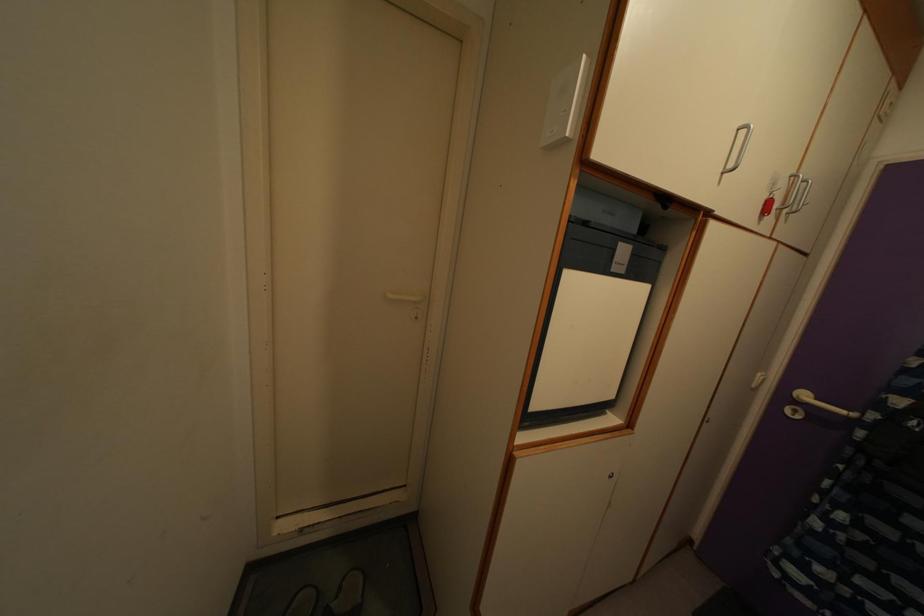
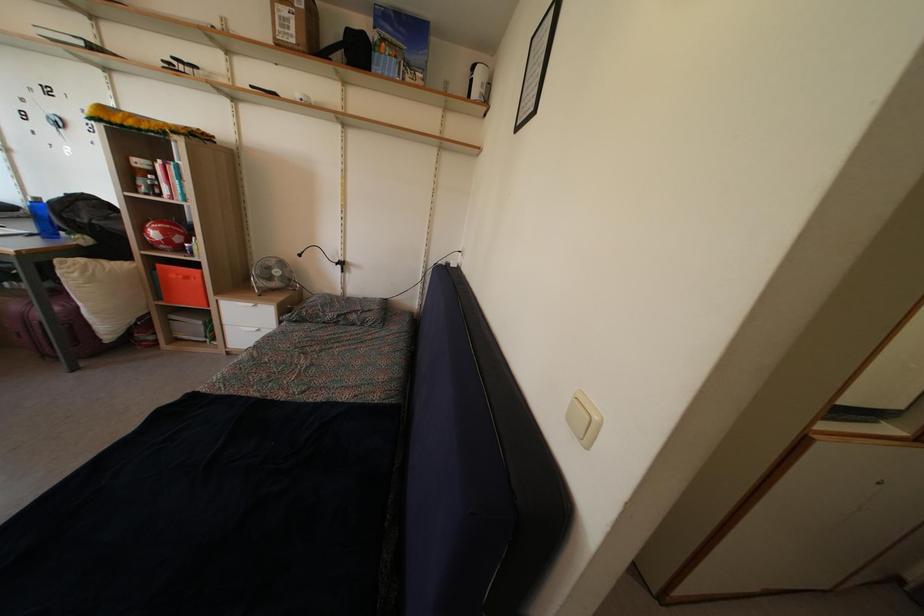
Question: The camera is either moving clockwise (left) or counter-clockwise (right) around the object. The first image is from the beginning of the video and the second image is from the end. Is the camera moving left or right when shooting the video?

Choices:
 (A) Left
 (B) Right

Answer: (B)